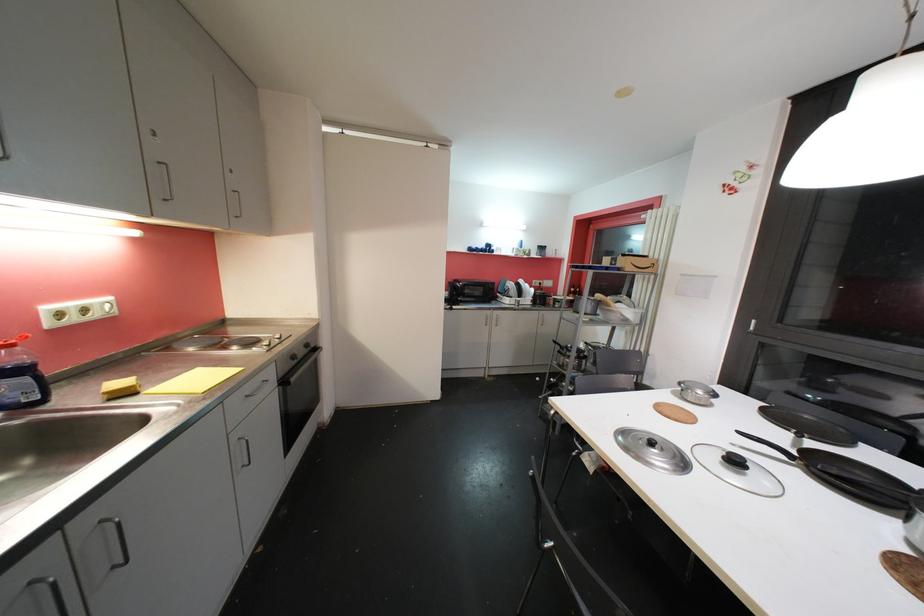
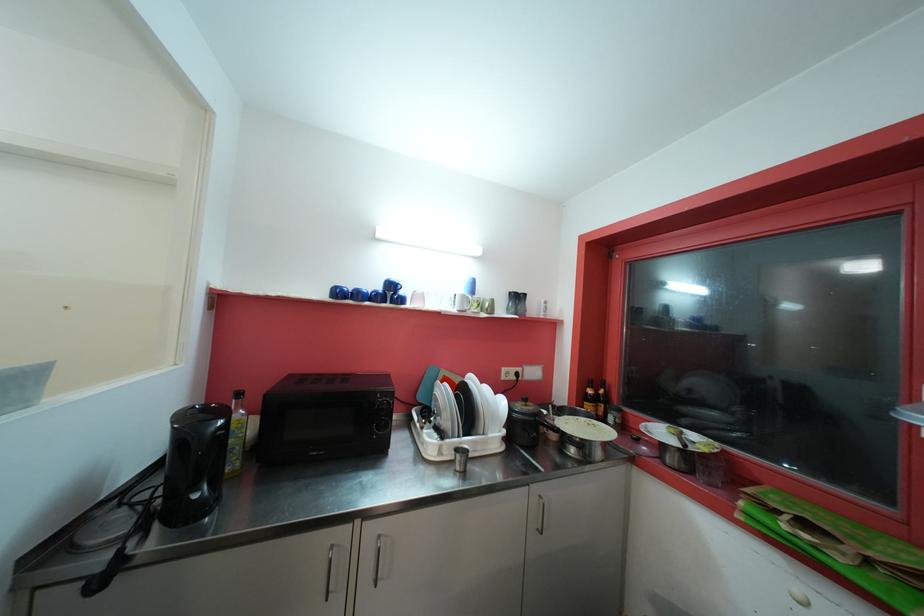
In the second image, find the point that corresponds to (479,249) in the first image.

(354, 290)